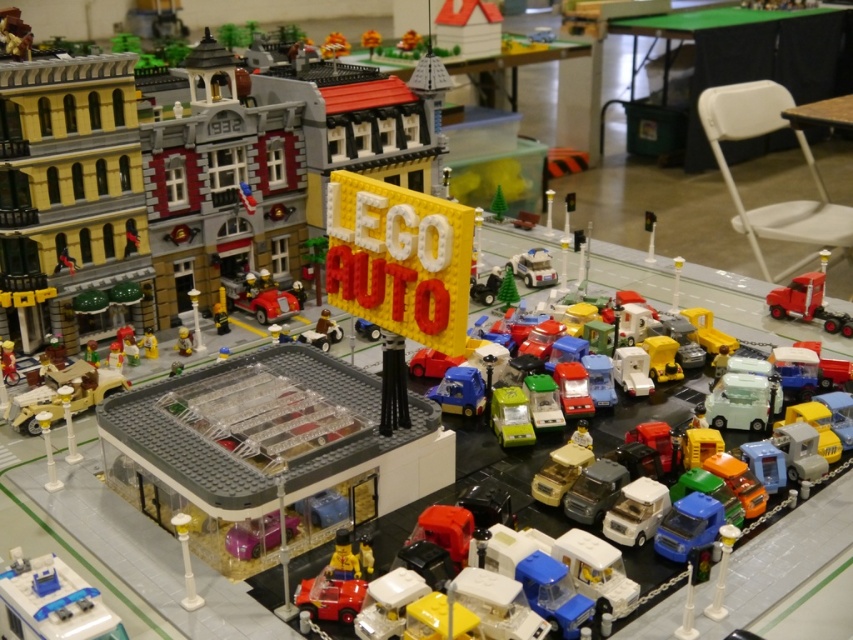
Question: Which point appears farthest from the camera in this image?

Choices:
 (A) (822, 106)
 (B) (120, 636)
 (C) (700, 64)
 (D) (148, 336)

Answer: (C)

Question: Is green fabric table at upper right in front of green plastic minifigure at center-left?

Choices:
 (A) no
 (B) yes

Answer: (A)

Question: Which object is the farthest from the wooden table at upper right?

Choices:
 (A) blue plastic police car at lower left
 (B) green fabric table at upper right

Answer: (A)

Question: Which point appears farthest from the camera in this image?

Choices:
 (A) (186, 348)
 (B) (96, 356)
 (C) (802, 81)

Answer: (C)

Question: Is green fabric table at upper right wider than translucent plastic building at center-left?

Choices:
 (A) no
 (B) yes

Answer: (B)

Question: Considering the relative positions of translucent plastic building at center-left and matte yellow minifigure at center in the image provided, where is translucent plastic building at center-left located with respect to matte yellow minifigure at center?

Choices:
 (A) below
 (B) above

Answer: (A)